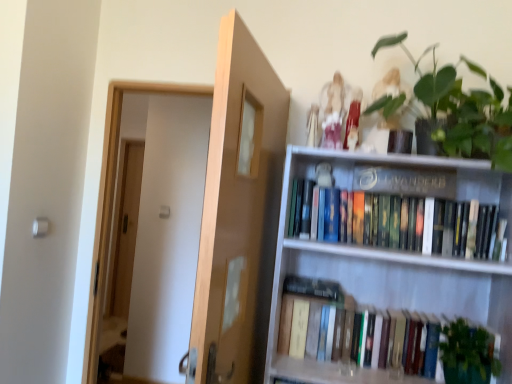
Question: Is hardcover books at upper right, which appears as the 1th book when viewed from the top, facing away from hardcover books at lower right, which is the second book from top to bottom?

Choices:
 (A) no
 (B) yes

Answer: (A)

Question: Is hardcover books at upper right, which appears as the 1th book when viewed from the top, positioned in front of hardcover books at lower right, which is the second book from top to bottom?

Choices:
 (A) no
 (B) yes

Answer: (B)

Question: Would you say hardcover books at lower right, which is the second book from top to bottom, is part of hardcover books at upper right, placed as the 2th book when sorted from bottom to top,'s contents?

Choices:
 (A) yes
 (B) no

Answer: (B)

Question: Considering the relative sizes of hardcover books at upper right, which appears as the 1th book when viewed from the top, and hardcover books at lower right, which is the second book from top to bottom, in the image provided, is hardcover books at upper right, which appears as the 1th book when viewed from the top, shorter than hardcover books at lower right, which is the second book from top to bottom,?

Choices:
 (A) yes
 (B) no

Answer: (B)

Question: Does hardcover books at upper right, which appears as the 1th book when viewed from the top, have a lesser width compared to hardcover books at lower right, which is the 1th book in bottom-to-top order?

Choices:
 (A) no
 (B) yes

Answer: (B)

Question: Is light brown wood door at center in front of or behind hardcover books at lower right, which is the second book from top to bottom, in the image?

Choices:
 (A) front
 (B) behind

Answer: (A)

Question: Looking at the image, does light brown wood door at center seem bigger or smaller compared to hardcover books at lower right, which is the second book from top to bottom?

Choices:
 (A) small
 (B) big

Answer: (B)

Question: From a real-world perspective, is light brown wood door at center physically located above or below hardcover books at lower right, which is the second book from top to bottom?

Choices:
 (A) below
 (B) above

Answer: (B)

Question: Visually, is light brown wood door at center positioned to the left or to the right of hardcover books at lower right, which is the second book from top to bottom?

Choices:
 (A) left
 (B) right

Answer: (A)

Question: Is light brown wood door at center in front of or behind matte black bookshelf at upper center in the image?

Choices:
 (A) front
 (B) behind

Answer: (A)

Question: From their relative heights in the image, would you say light brown wood door at center is taller or shorter than matte black bookshelf at upper center?

Choices:
 (A) tall
 (B) short

Answer: (A)

Question: From the image's perspective, is light brown wood door at center located above or below matte black bookshelf at upper center?

Choices:
 (A) below
 (B) above

Answer: (A)

Question: Is light brown wood door at center wider or thinner than matte black bookshelf at upper center?

Choices:
 (A) thin
 (B) wide

Answer: (B)

Question: From the image's perspective, is matte black bookshelf at upper center located above or below green leafy plant at lower right?

Choices:
 (A) below
 (B) above

Answer: (B)

Question: Considering the positions of matte black bookshelf at upper center and green leafy plant at lower right in the image, is matte black bookshelf at upper center wider or thinner than green leafy plant at lower right?

Choices:
 (A) thin
 (B) wide

Answer: (A)